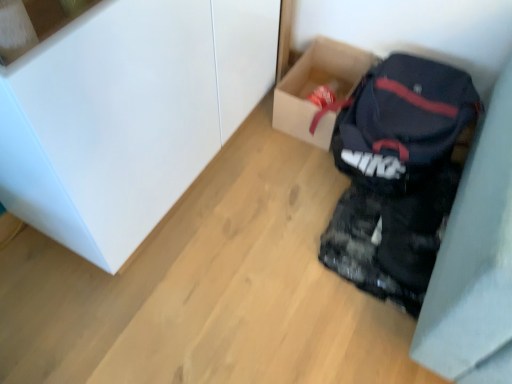
Find the location of a particular element. white glossy cabinet at upper left is located at coordinates (128, 115).

Can you confirm if matte black backpack at lower right is taller than cardboard box at center?

Indeed, matte black backpack at lower right has a greater height compared to cardboard box at center.

From a real-world perspective, who is located higher, matte black backpack at lower right or cardboard box at center?

matte black backpack at lower right, from a real-world perspective.

Is point (348, 130) farther from viewer compared to point (282, 81)?

No, (348, 130) is in front of (282, 81).

Is matte black backpack at lower right not within cardboard box at center?

Yes, matte black backpack at lower right is located beyond the bounds of cardboard box at center.

Is white glossy cabinet at upper left located outside matte black backpack at lower right?

Indeed, white glossy cabinet at upper left is completely outside matte black backpack at lower right.

Does point (46, 94) come closer to viewer compared to point (348, 101)?

Yes, point (46, 94) is closer to viewer.

Who is more distant, white glossy cabinet at upper left or matte black backpack at lower right?

Positioned behind is matte black backpack at lower right.

From the image's perspective, between white glossy cabinet at upper left and matte black backpack at lower right, which one is located above?

white glossy cabinet at upper left, from the image's perspective.

Is white glossy cabinet at upper left thinner than cardboard box at center?

No.

I want to click on box located on the right of white glossy cabinet at upper left, so click(x=316, y=87).

Is white glossy cabinet at upper left bigger or smaller than cardboard box at center?

white glossy cabinet at upper left is bigger than cardboard box at center.

Which is more to the left, cardboard box at center or matte black backpack at lower right?

cardboard box at center.

Is cardboard box at center spatially inside matte black backpack at lower right, or outside of it?

cardboard box at center is spatially situated outside matte black backpack at lower right.

Considering the relative sizes of cardboard box at center and matte black backpack at lower right in the image provided, is cardboard box at center wider than matte black backpack at lower right?

In fact, cardboard box at center might be narrower than matte black backpack at lower right.

Is the depth of cardboard box at center less than that of matte black backpack at lower right?

No.

From the image's perspective, relative to white glossy cabinet at upper left, is matte black backpack at lower right above or below?

matte black backpack at lower right is below white glossy cabinet at upper left.

Is matte black backpack at lower right to the left of white glossy cabinet at upper left from the viewer's perspective?

No.

In the scene shown: Can you tell me how much matte black backpack at lower right and white glossy cabinet at upper left differ in facing direction?

The facing directions of matte black backpack at lower right and white glossy cabinet at upper left are 85.8 degrees apart.

Is matte black backpack at lower right positioned far away from white glossy cabinet at upper left?

No, there isn't a large distance between matte black backpack at lower right and white glossy cabinet at upper left.

Where is `cabinetry above the cardboard box at center (from a real-world perspective)`? cabinetry above the cardboard box at center (from a real-world perspective) is located at coordinates (128, 115).

From a real-world perspective, is cardboard box at center positioned over white glossy cabinet at upper left based on gravity?

No, from a real-world perspective, cardboard box at center is not over white glossy cabinet at upper left

How different are the orientations of cardboard box at center and white glossy cabinet at upper left in degrees?

The angle between the facing direction of cardboard box at center and the facing direction of white glossy cabinet at upper left is 88.4 degrees.

Does cardboard box at center have a lesser height compared to white glossy cabinet at upper left?

Indeed, cardboard box at center has a lesser height compared to white glossy cabinet at upper left.

Identify the location of backpack on the right of cardboard box at center. (402, 123).

You are a GUI agent. You are given a task and a screenshot of the screen. Output one action in this format:
    pyautogui.click(x=<x>, y=<y>)
    Task: Click on the cabinetry that appears above the matte black backpack at lower right (from the image's perspective)
    Image resolution: width=512 pixels, height=384 pixels.
    Given the screenshot: What is the action you would take?
    pyautogui.click(x=128, y=115)

Which object lies nearer to the anchor point white glossy cabinet at upper left, cardboard box at center or matte black backpack at lower right?

Among the two, cardboard box at center is located nearer to white glossy cabinet at upper left.

From the picture: Which object lies nearer to the anchor point cardboard box at center, matte black backpack at lower right or white glossy cabinet at upper left?

Among the two, matte black backpack at lower right is located nearer to cardboard box at center.

From the image, which object appears to be nearer to cardboard box at center, white glossy cabinet at upper left or matte black backpack at lower right?

matte black backpack at lower right.

When comparing their distances from white glossy cabinet at upper left, does matte black backpack at lower right or cardboard box at center seem further?

matte black backpack at lower right is further to white glossy cabinet at upper left.

Looking at the image, which one is located further to matte black backpack at lower right, white glossy cabinet at upper left or cardboard box at center?

white glossy cabinet at upper left lies further to matte black backpack at lower right than the other object.

Looking at the image, which one is located further to matte black backpack at lower right, cardboard box at center or white glossy cabinet at upper left?

white glossy cabinet at upper left.

Locate an element on the screen. The image size is (512, 384). backpack located between white glossy cabinet at upper left and cardboard box at center in the depth direction is located at coordinates (402, 123).